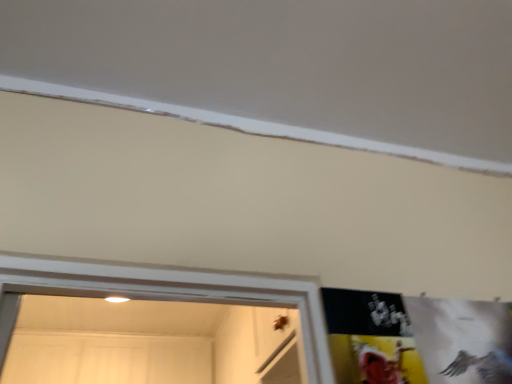
Describe the element at coordinates (417, 339) in the screenshot. I see `white matte poster at right` at that location.

I want to click on white matte poster at right, so click(x=417, y=339).

Where is `white matte poster at right`? This screenshot has width=512, height=384. white matte poster at right is located at coordinates (417, 339).